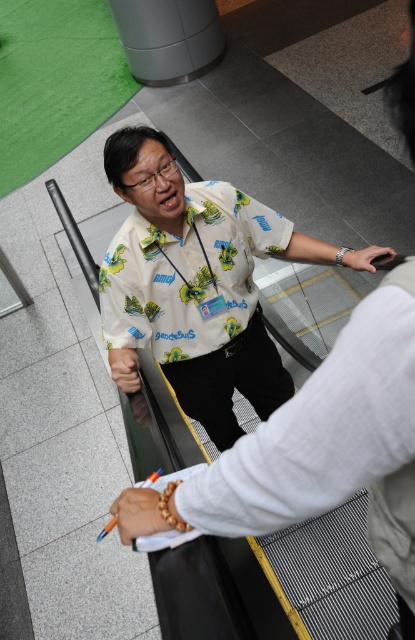
Question: Which object appears closest to the camera in this image?

Choices:
 (A) white printed shirt at center
 (B) orange beaded bracelet at lower center
 (C) matte black hand at center
 (D) satin black watch at upper center

Answer: (B)

Question: Does orange beaded bracelet at lower center have a smaller size compared to satin black watch at upper center?

Choices:
 (A) yes
 (B) no

Answer: (A)

Question: Is white printed shirt at center closer to the viewer compared to satin black watch at upper center?

Choices:
 (A) no
 (B) yes

Answer: (A)

Question: Considering the relative positions of orange beaded bracelet at lower center and satin black watch at upper center in the image provided, where is orange beaded bracelet at lower center located with respect to satin black watch at upper center?

Choices:
 (A) below
 (B) above

Answer: (A)

Question: Which is farther from the satin black watch at upper center?

Choices:
 (A) orange beaded bracelet at lower center
 (B) white printed shirt at center

Answer: (A)

Question: Which object is positioned farthest from the satin black watch at upper center?

Choices:
 (A) orange beaded bracelet at lower center
 (B) matte black hand at center
 (C) white printed shirt at center

Answer: (A)